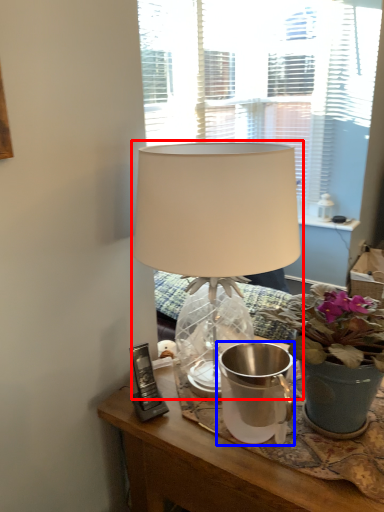
Question: Among these objects, which one is farthest to the camera, lamp (highlighted by a red box) or watering can (highlighted by a blue box)?

Choices:
 (A) lamp
 (B) watering can

Answer: (B)